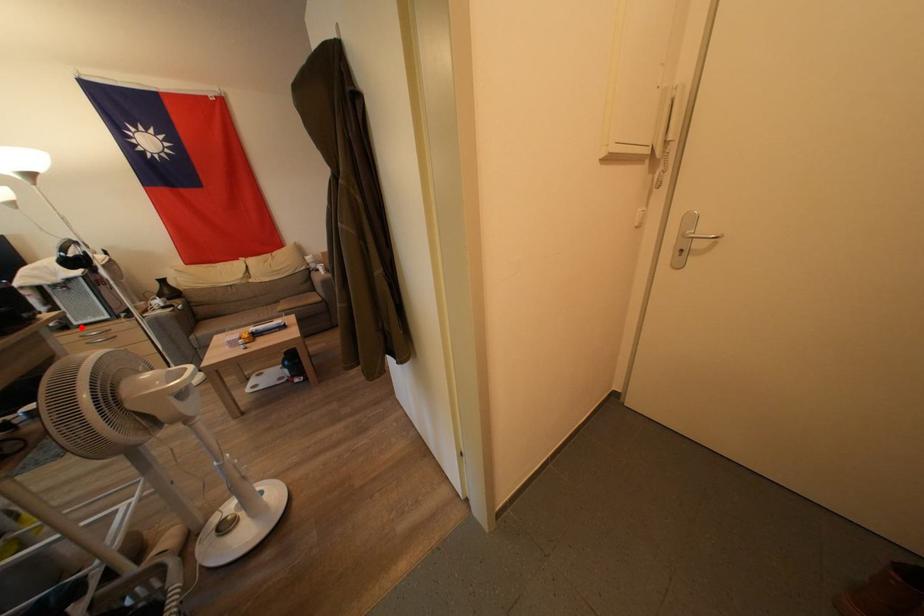
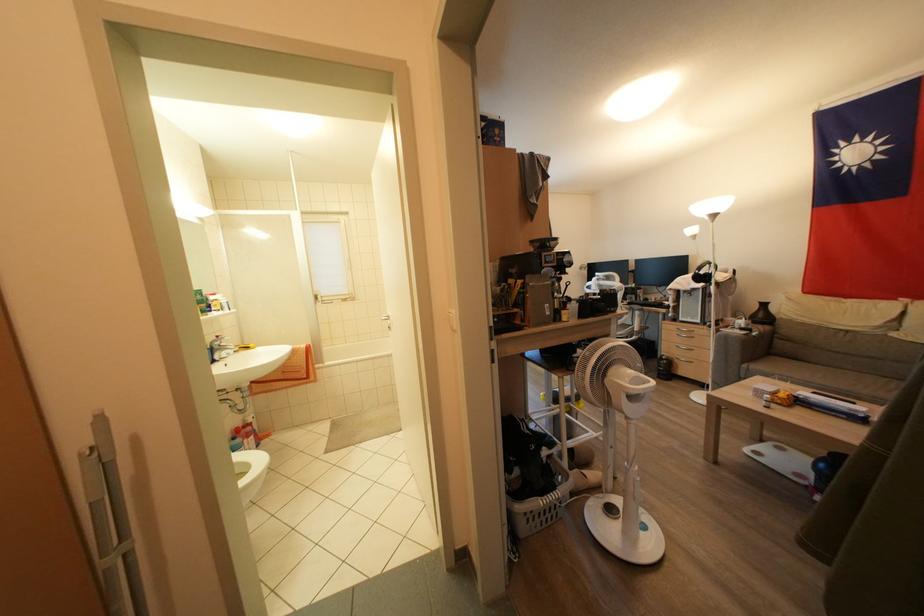
Question: I am providing you with two images of the same scene from different viewpoints. A red point is shown in image1. For the corresponding object point in image2, is it positioned nearer or farther from the camera?

Choices:
 (A) Nearer
 (B) Farther

Answer: (A)